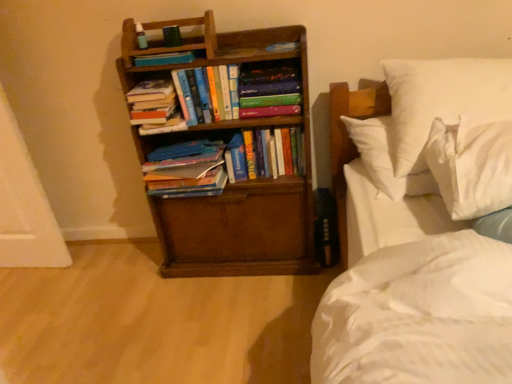
In order to face hardcover books at left, the 5th book positioned from the right, should I rotate leftwards or rightwards?

Turn left by 12.526 degrees to look at hardcover books at left, the 5th book positioned from the right.

This screenshot has height=384, width=512. I want to click on hardcover books at left, which is the first book from left to right, so click(155, 107).

What do you see at coordinates (440, 99) in the screenshot? I see `white soft pillow at upper right, the first pillow in the back-to-front sequence` at bounding box center [440, 99].

Image resolution: width=512 pixels, height=384 pixels. Describe the element at coordinates (164, 59) in the screenshot. I see `hardcover book at center, placed as the fourth book when sorted from right to left` at that location.

Measure the distance between point (x=179, y=55) and camera.

The distance of point (x=179, y=55) from camera is 1.47 meters.

Locate an element on the screen. The width and height of the screenshot is (512, 384). hardcover books at left, the 5th book positioned from the right is located at coordinates (155, 107).

Is hardcover books at left, the 5th book positioned from the right, taller or shorter than hardcover books at center, the third book from the left?

Considering their sizes, hardcover books at left, the 5th book positioned from the right, has less height than hardcover books at center, the third book from the left.

Is hardcover books at left, which is the first book from left to right, facing towards hardcover books at center, which ranks as the 3th book in right-to-left order?

No, hardcover books at left, which is the first book from left to right, is not facing towards hardcover books at center, which ranks as the 3th book in right-to-left order.

Is hardcover books at center, the third book from the left, a part of hardcover books at left, the 5th book positioned from the right?

Actually, hardcover books at center, the third book from the left, is outside hardcover books at left, the 5th book positioned from the right.

Is hardcover books at left, the 5th book positioned from the right, closer to camera compared to hardcover books at center, which ranks as the 3th book in right-to-left order?

No, the depth of hardcover books at left, the 5th book positioned from the right, is greater than that of hardcover books at center, which ranks as the 3th book in right-to-left order.

In the scene shown: Are hardcover book at center, placed as the fourth book when sorted from right to left, and hardcover books at center, the third book from the left, located far from each other?

No, hardcover book at center, placed as the fourth book when sorted from right to left, is in close proximity to hardcover books at center, the third book from the left.

Looking at this image, can you tell me how much hardcover book at center, marked as the second book in a left-to-right arrangement, and hardcover books at center, the third book from the left, differ in facing direction?

1.41 degrees.

Considering the positions of objects hardcover book at center, marked as the second book in a left-to-right arrangement, and hardcover books at center, the third book from the left, in the image provided, who is in front, hardcover book at center, marked as the second book in a left-to-right arrangement, or hardcover books at center, the third book from the left,?

hardcover books at center, the third book from the left, is closer to the camera.

From a real-world perspective, which is physically above, hardcover book at center, marked as the second book in a left-to-right arrangement, or hardcover books at center, the third book from the left?

hardcover book at center, marked as the second book in a left-to-right arrangement.

Is white soft pillow at upper right, the first pillow in the back-to-front sequence, touching hardcover books at left, the 5th book positioned from the right?

No, white soft pillow at upper right, the first pillow in the back-to-front sequence, is not beside hardcover books at left, the 5th book positioned from the right.

Is white soft pillow at upper right, the first pillow in the back-to-front sequence, further to camera compared to hardcover books at left, which is the first book from left to right?

No, white soft pillow at upper right, the first pillow in the back-to-front sequence, is closer to the viewer.

The height and width of the screenshot is (384, 512). Find the location of `the 1st book positioned above the white soft pillow at upper right, the first pillow in the back-to-front sequence (from a real-world perspective)`. the 1st book positioned above the white soft pillow at upper right, the first pillow in the back-to-front sequence (from a real-world perspective) is located at coordinates (155, 107).

Considering the sizes of objects white soft pillow at upper right, the 2th pillow from the front, and hardcover books at left, which is the first book from left to right, in the image provided, who is smaller, white soft pillow at upper right, the 2th pillow from the front, or hardcover books at left, which is the first book from left to right,?

With smaller size is hardcover books at left, which is the first book from left to right.

Is point (291, 145) more distant than point (468, 91)?

Yes, point (291, 145) is farther from viewer.

Considering the sizes of hardcover books at center, the 2th book positioned from the right, and white soft pillow at upper right, the first pillow in the back-to-front sequence, in the image, is hardcover books at center, the 2th book positioned from the right, wider or thinner than white soft pillow at upper right, the first pillow in the back-to-front sequence,?

Considering their sizes, hardcover books at center, the 2th book positioned from the right, looks slimmer than white soft pillow at upper right, the first pillow in the back-to-front sequence.

Does hardcover books at center, the 2th book positioned from the right, appear on the right side of white soft pillow at upper right, the first pillow in the back-to-front sequence?

In fact, hardcover books at center, the 2th book positioned from the right, is to the left of white soft pillow at upper right, the first pillow in the back-to-front sequence.

Does point (145, 146) appear closer or farther from the camera than point (284, 155)?

Point (145, 146).

Based on the photo, is brown wooden bookcase at left facing away from hardcover books at center, the 2th book positioned from the right?

Yes.

How many degrees apart are the facing directions of brown wooden bookcase at left and hardcover books at center, the 2th book positioned from the right?

0.869 degrees separate the facing orientations of brown wooden bookcase at left and hardcover books at center, the 2th book positioned from the right.

Does brown wooden bookcase at left have a lesser height compared to hardcover books at center, the 4th book from the left?

In fact, brown wooden bookcase at left may be taller than hardcover books at center, the 4th book from the left.

Is point (226, 227) behind point (237, 84)?

Yes, point (226, 227) is behind point (237, 84).

From the image's perspective, is brown wooden bookcase at left located beneath hardcover books at center, which ranks as the 3th book in right-to-left order?

Yes.

Is brown wooden bookcase at left with hardcover books at center, the third book from the left?

No, brown wooden bookcase at left is not touching hardcover books at center, the third book from the left.

Is brown wooden bookcase at left turned away from hardcover books at center, the third book from the left?

That's right, brown wooden bookcase at left is facing away from hardcover books at center, the third book from the left.

Considering the relative sizes of hardcover books at center, which ranks as the 3th book in right-to-left order, and brown wooden bookcase at left in the image provided, is hardcover books at center, which ranks as the 3th book in right-to-left order, thinner than brown wooden bookcase at left?

Yes.

Looking at this image, is hardcover books at center, the third book from the left, in front of or behind brown wooden bookcase at left in the image?

hardcover books at center, the third book from the left, is positioned farther from the viewer than brown wooden bookcase at left.

Would you consider hardcover books at center, the third book from the left, to be distant from brown wooden bookcase at left?

No, hardcover books at center, the third book from the left, is not far from brown wooden bookcase at left.

Can we say hardcover books at center, the third book from the left, lies outside brown wooden bookcase at left?

No, hardcover books at center, the third book from the left, is not entirely external to brown wooden bookcase at left.

Starting from the hardcover books at left, which is the first book from left to right, which book is the 2nd one to the right? Please provide its 2D coordinates.

[(208, 93)]

This screenshot has width=512, height=384. In order to click on book above the hardcover books at center, which ranks as the 3th book in right-to-left order (from a real-world perspective) in this screenshot , I will do `click(164, 59)`.

When comparing their distances from hardcover book at center, placed as the fourth book when sorted from right to left, does brown wooden bookcase at left or white soft pillow at upper right, the 2th pillow from the front, seem closer?

Based on the image, brown wooden bookcase at left appears to be nearer to hardcover book at center, placed as the fourth book when sorted from right to left.

From the picture: From the image, which object appears to be nearer to hardcover books at center, the third book from the left, hardcover books at center, the 4th book from the left, or hardcover book at center, which is the 5th book from left to right?

The object closer to hardcover books at center, the third book from the left, is hardcover book at center, which is the 5th book from left to right.

Consider the image. Looking at the image, which one is located further to hardcover books at left, which is the first book from left to right, hardcover books at center, the 4th book from the left, or white soft pillow at upper right, the first pillow in the back-to-front sequence?

Based on the image, white soft pillow at upper right, the first pillow in the back-to-front sequence, appears to be further to hardcover books at left, which is the first book from left to right.

Considering their positions, is hardcover books at left, which is the first book from left to right, positioned further to hardcover books at center, which ranks as the 3th book in right-to-left order, than hardcover book at center, arranged as the 1th book when viewed from the right?

hardcover book at center, arranged as the 1th book when viewed from the right, is positioned further to the anchor hardcover books at center, which ranks as the 3th book in right-to-left order.

Which object lies further to the anchor point hardcover book at center, placed as the fourth book when sorted from right to left, brown wooden bookcase at left or white soft pillow at upper right, the 1th pillow viewed from the front?

white soft pillow at upper right, the 1th pillow viewed from the front, lies further to hardcover book at center, placed as the fourth book when sorted from right to left, than the other object.

Consider the image. Estimate the real-world distances between objects in this image. Which object is further from hardcover book at center, which is the 5th book from left to right, white soft pillow at upper right, the first pillow in the back-to-front sequence, or white soft pillow at upper right, the 1th pillow viewed from the front?

white soft pillow at upper right, the 1th pillow viewed from the front, lies further to hardcover book at center, which is the 5th book from left to right, than the other object.

Estimate the real-world distances between objects in this image. Which object is further from hardcover book at center, which is the 5th book from left to right, hardcover books at left, the 5th book positioned from the right, or hardcover books at center, the third book from the left?

Among the two, hardcover books at left, the 5th book positioned from the right, is located further to hardcover book at center, which is the 5th book from left to right.

From the image, which object appears to be farther from hardcover book at center, marked as the second book in a left-to-right arrangement, brown wooden bookcase at left or hardcover books at center, which ranks as the 3th book in right-to-left order?

brown wooden bookcase at left.

Find the location of a particular element. The width and height of the screenshot is (512, 384). bookcase between hardcover book at center, marked as the second book in a left-to-right arrangement, and white soft pillow at upper right, the first pillow in the back-to-front sequence is located at coordinates click(237, 182).

The height and width of the screenshot is (384, 512). Identify the location of pillow between brown wooden bookcase at left and white soft pillow at upper right, the 2th pillow from the front. (472, 164).

What are the coordinates of `bookcase between hardcover book at center, placed as the fourth book when sorted from right to left, and white soft pillow at upper right, the 1th pillow viewed from the front, from left to right` in the screenshot? It's located at 237,182.

Find the location of a particular element. The height and width of the screenshot is (384, 512). book between hardcover books at center, the 2th book positioned from the right, and white soft pillow at upper right, the first pillow in the back-to-front sequence, from left to right is located at coordinates (269, 89).